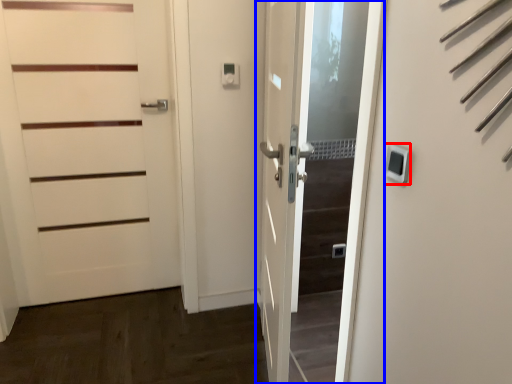
Question: Among these objects, which one is nearest to the camera, thermostat (highlighted by a red box) or door (highlighted by a blue box)?

Choices:
 (A) thermostat
 (B) door

Answer: (A)